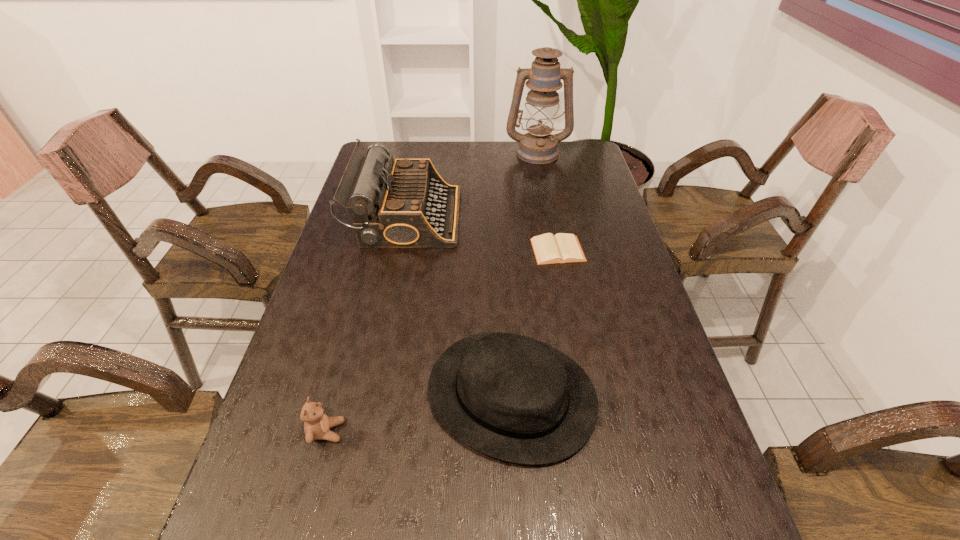
Where is `the tallest object`? The width and height of the screenshot is (960, 540). the tallest object is located at coordinates (539, 146).

Where is `oil lamp`? oil lamp is located at coordinates (539, 146).

Locate an element on the screen. Image resolution: width=960 pixels, height=540 pixels. typewriter is located at coordinates (408, 205).

The height and width of the screenshot is (540, 960). In order to click on fedora in this screenshot , I will do (x=514, y=398).

Identify the location of teddy bear. (317, 424).

You are a GUI agent. You are given a task and a screenshot of the screen. Output one action in this format:
    pyautogui.click(x=<x>, y=<y>)
    Task: Click on the diary
    
    Given the screenshot: What is the action you would take?
    (561, 248)

Locate an element on the screen. This screenshot has width=960, height=540. vacant position located on the left of the tallest object is located at coordinates (402, 152).

Locate an element on the screen. vacant space positioned 0.160m on the keyboard of the fourth shortest object is located at coordinates (509, 217).

The image size is (960, 540). Identify the location of free region located on the left of the fedora. tap(276, 394).

Where is `free space located on the front-facing side of the teddy bear`? free space located on the front-facing side of the teddy bear is located at coordinates (497, 431).